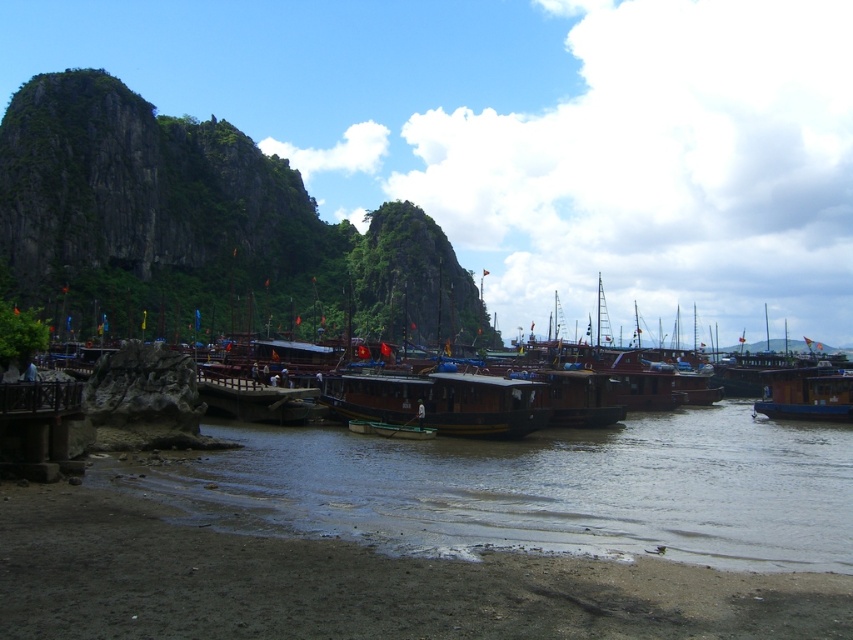
You are a tour guide leading a group to the green wooden boat at center. The brown wooden boat at center is blocking the path. Can you safely walk between them if your group needs 10 feet of space?

The distance between the brown wooden boat at center and the green wooden boat at center is 9.11 feet, which is less than the required 10 feet of space. Therefore, the group cannot safely walk between them.

You are a tourist planning to take a boat tour. You see the brown wooden boat at right and the green wooden boat at center. Which boat is taller?

The brown wooden boat at right is much taller than the green wooden boat at center.

You are a tourist standing on the wooden pier and want to take a photo of both the brown wooden boat at center and the brown wooden boat at right. Which boat should you move towards to ensure both are in the frame?

You should move towards the brown wooden boat at right because the brown wooden boat at center is positioned on the left side of the brown wooden boat at right, so both will be visible in the frame when you position yourself closer to the right boat.